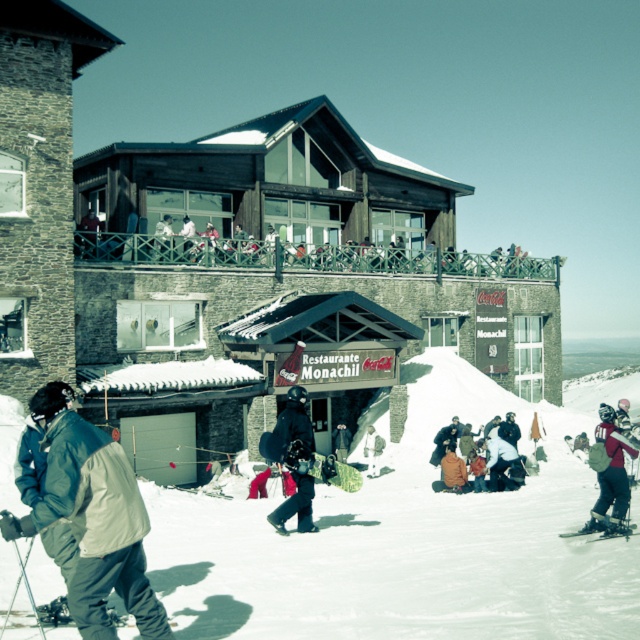
Question: Does wooden ski resort at center come behind white powder snow at center?

Choices:
 (A) no
 (B) yes

Answer: (B)

Question: Is green fabric jacket at lower left smaller than metallic silver ski at lower right?

Choices:
 (A) yes
 (B) no

Answer: (B)

Question: Does matte black snowboarder at center appear over metallic silver ski at lower right?

Choices:
 (A) yes
 (B) no

Answer: (A)

Question: Which object appears closest to the camera in this image?

Choices:
 (A) green fabric jacket at lower left
 (B) matte black snowboarder at center

Answer: (A)

Question: Which object is farther from the camera taking this photo?

Choices:
 (A) red ski jacket at lower right
 (B) orange snowboard at center
 (C) wooden ski resort at center

Answer: (B)

Question: Which is farther from the white powder snow at center?

Choices:
 (A) green fabric jacket at lower left
 (B) metallic silver ski at lower right
 (C) green matte snowboard at center

Answer: (A)